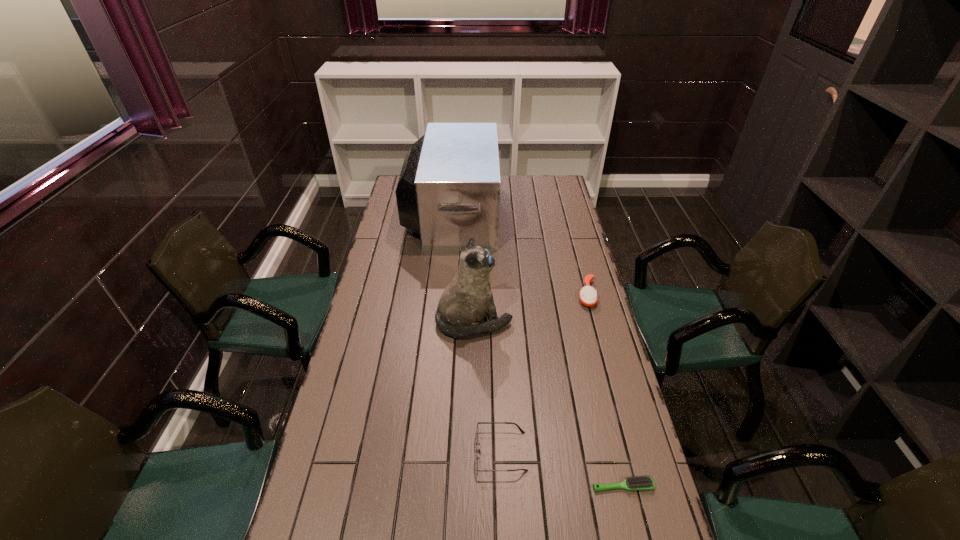
The width and height of the screenshot is (960, 540). I want to click on vacant space that satisfies the following two spatial constraints: 1. on the front-facing side of the nearest object; 2. on the left side of the microwave oven, so click(x=428, y=486).

This screenshot has height=540, width=960. Find the location of `free point that satisfies the following two spatial constraints: 1. on the front-facing side of the shortest object; 2. on the left side of the spectacles`. free point that satisfies the following two spatial constraints: 1. on the front-facing side of the shortest object; 2. on the left side of the spectacles is located at coordinates (502, 486).

Locate an element on the screen. free location that satisfies the following two spatial constraints: 1. on the back side of the nearest object; 2. on the front-facing side of the microwave oven is located at coordinates (557, 213).